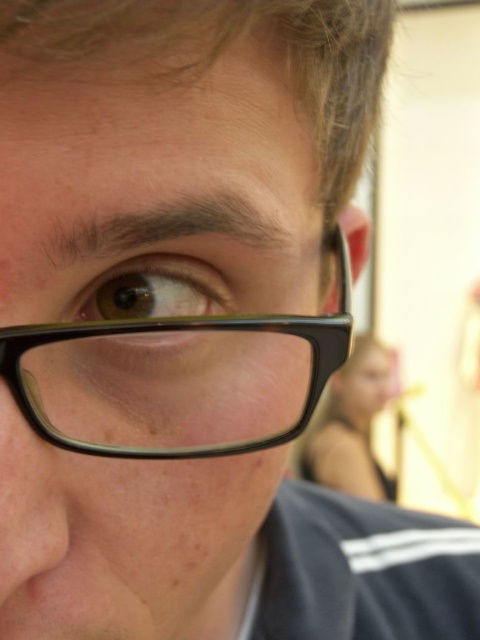
Question: Is black matte glasses at center wider than black plastic glasses at center?

Choices:
 (A) no
 (B) yes

Answer: (A)

Question: Which point is farther to the camera?

Choices:
 (A) (132, 342)
 (B) (288, 426)

Answer: (B)

Question: Can you confirm if black matte glasses at center is positioned below brown matte eye at center?

Choices:
 (A) yes
 (B) no

Answer: (A)

Question: Which object is closer to the camera taking this photo?

Choices:
 (A) black matte glasses at center
 (B) brown matte eye at center

Answer: (A)

Question: Observing the image, what is the correct spatial positioning of black matte glasses at center in reference to brown matte eye at center?

Choices:
 (A) below
 (B) above

Answer: (A)

Question: Among these objects, which one is nearest to the camera?

Choices:
 (A) black plastic glasses at center
 (B) black matte glasses at center

Answer: (B)